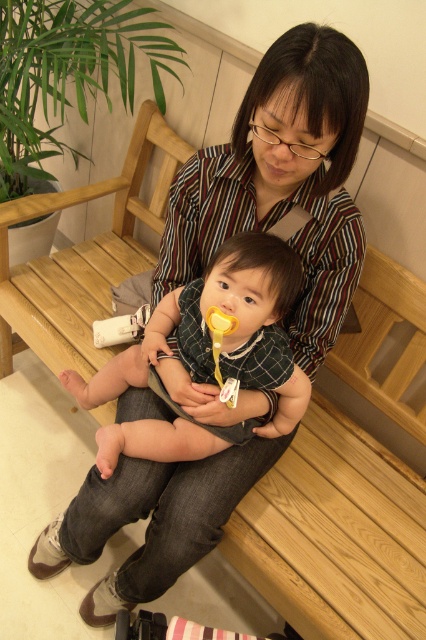
Who is lower down, soft yellow pacifier at center or yellow rubber spoon at center?

soft yellow pacifier at center is below.

Which is behind, point (301, 381) or point (215, 365)?

The point (301, 381) is behind.

Where is `soft yellow pacifier at center`? The width and height of the screenshot is (426, 640). soft yellow pacifier at center is located at coordinates (224, 337).